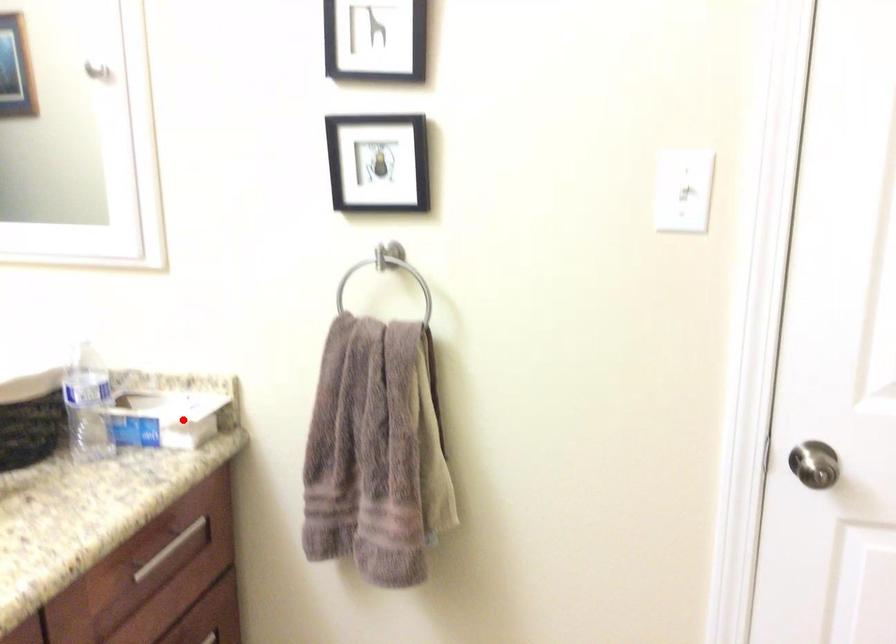
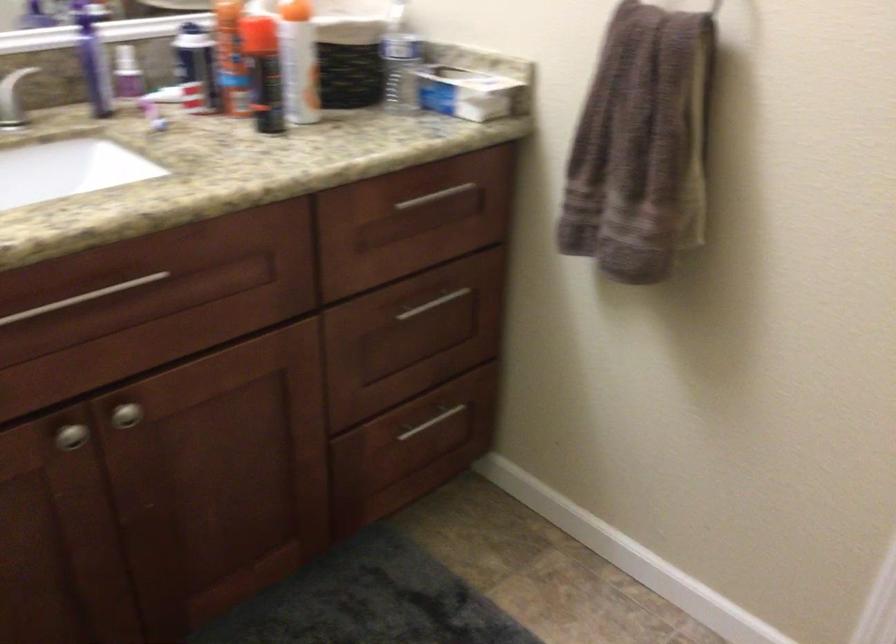
Find the pixel in the second image that matches the highlighted location in the first image.

(470, 91)